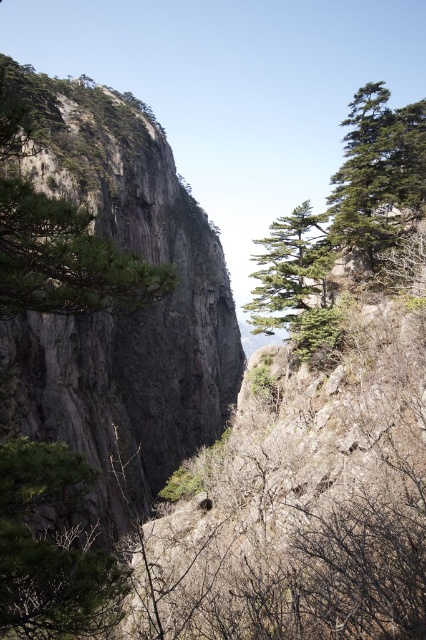
How distant is green matte tree at upper right from green matte tree at center?

green matte tree at upper right is 12.05 feet away from green matte tree at center.

Find the location of a particular element. This screenshot has height=640, width=426. green matte tree at upper right is located at coordinates (377, 170).

Which is in front, point (397, 125) or point (250, 323)?

Positioned in front is point (250, 323).

This screenshot has height=640, width=426. I want to click on green matte tree at upper right, so click(x=377, y=170).

Does green rough rock at upper left have a lesser width compared to green matte tree at center?

No, green rough rock at upper left is not thinner than green matte tree at center.

Locate an element on the screen. The image size is (426, 640). green rough rock at upper left is located at coordinates (65, 259).

The image size is (426, 640). Identify the location of green matte tree at lower left. (51, 548).

Does point (55, 468) come farther from viewer compared to point (296, 284)?

That is False.

This screenshot has width=426, height=640. Identify the location of green matte tree at lower left. (51, 548).